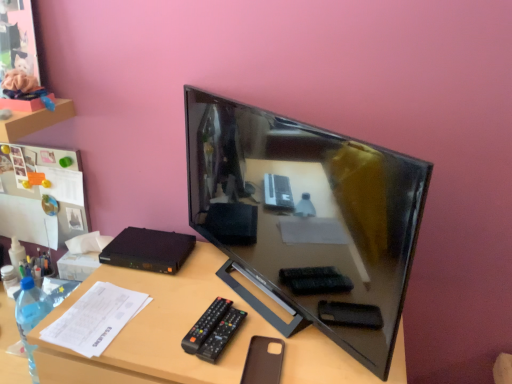
Identify the location of free region under black glossy television at center (from a real-world perspective). This screenshot has height=384, width=512. (270, 299).